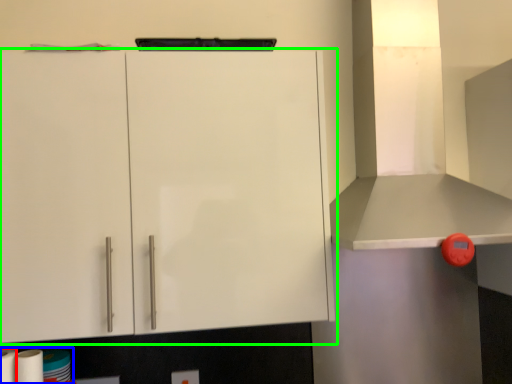
Question: Estimate the real-world distances between objects in this image. Which object is closer to paper towel (highlighted by a red box), toilet paper (highlighted by a blue box) or cabinetry (highlighted by a green box)?

Choices:
 (A) toilet paper
 (B) cabinetry

Answer: (A)